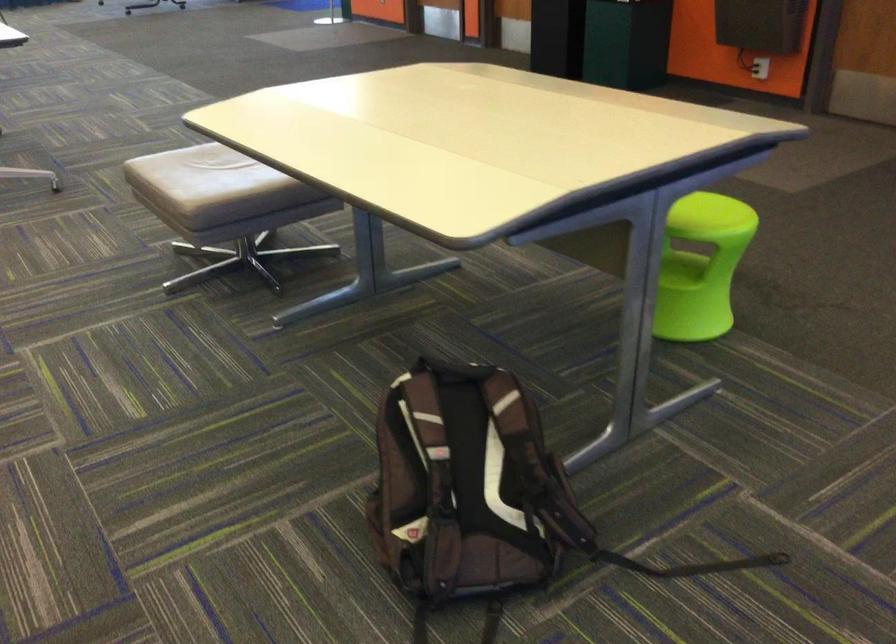
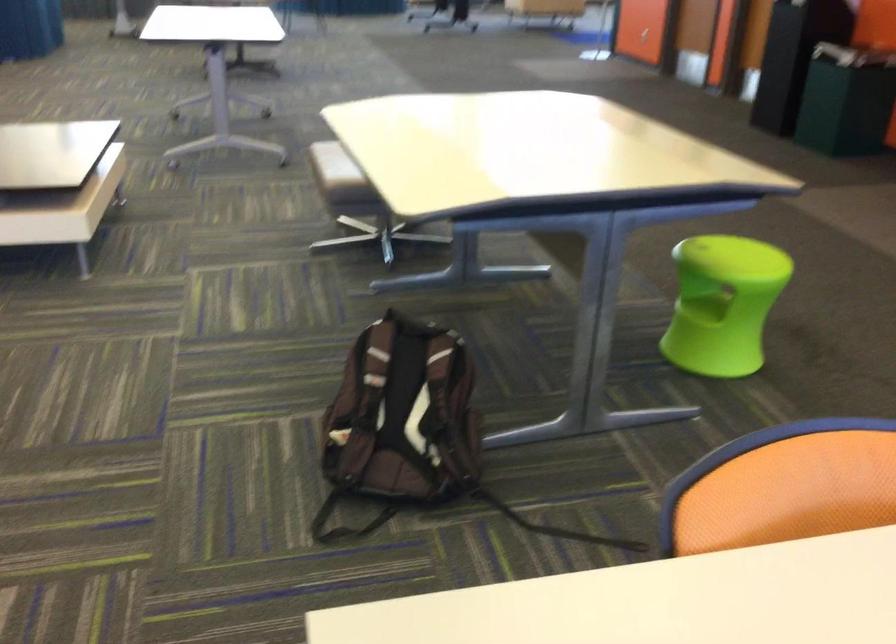
Question: I am providing you with two images of the same scene from different viewpoints. After the viewpoint changes to image2, which objects are now occluded?

Choices:
 (A) brown backpack
 (B) green stool sitting surface
 (C) green stool handle
 (D) none of these

Answer: (D)